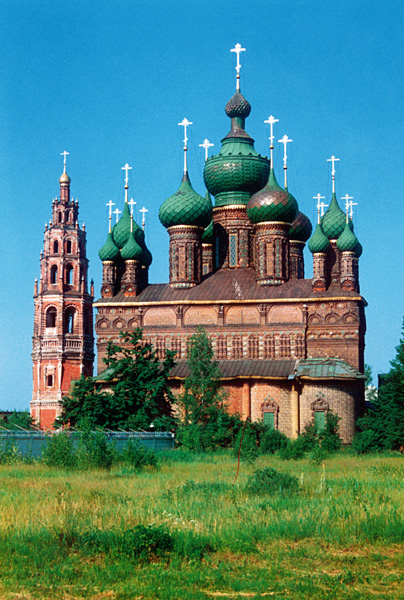
Where is `window`? Image resolution: width=404 pixels, height=600 pixels. window is located at coordinates (223, 245).